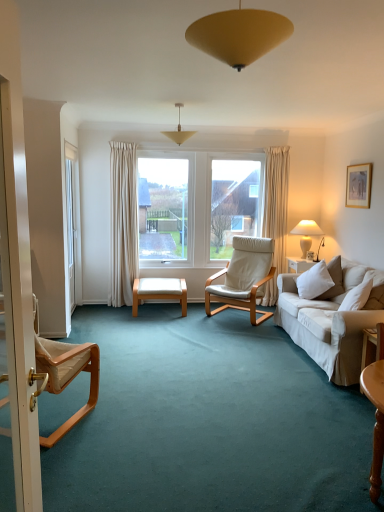
Identify the location of free area below matte yellow pendant light at upper center, arranged as the second lamp when viewed from the front (from a real-world perspective). The image size is (384, 512). (184, 334).